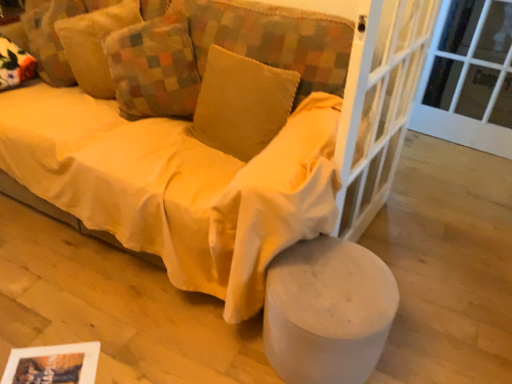
Question: Is point (455, 49) positioned closer to the camera than point (390, 165)?

Choices:
 (A) closer
 (B) farther

Answer: (B)

Question: In terms of width, does white glass door at upper right look wider or thinner when compared to white glass screen door at center right?

Choices:
 (A) wide
 (B) thin

Answer: (B)

Question: Considering the real-world distances, which object is closest to the white glass door at upper right?

Choices:
 (A) soft yellow cushion at upper left, the first pillow in the left-to-right sequence
 (B) white fabric stool at lower right
 (C) matte yellow fabric couch at center
 (D) velvet yellow pillow at center, which is counted as the third pillow, starting from the left
 (E) multicolored patchwork pillow at upper left, which ranks as the 2th pillow in right-to-left order

Answer: (D)

Question: Which object is the closest to the velvet yellow pillow at center, which is counted as the third pillow, starting from the left?

Choices:
 (A) multicolored patchwork pillow at upper left, which ranks as the 2th pillow in right-to-left order
 (B) matte yellow fabric couch at center
 (C) soft yellow cushion at upper left, the first pillow in the left-to-right sequence
 (D) white glass door at upper right
 (E) white fabric stool at lower right

Answer: (A)